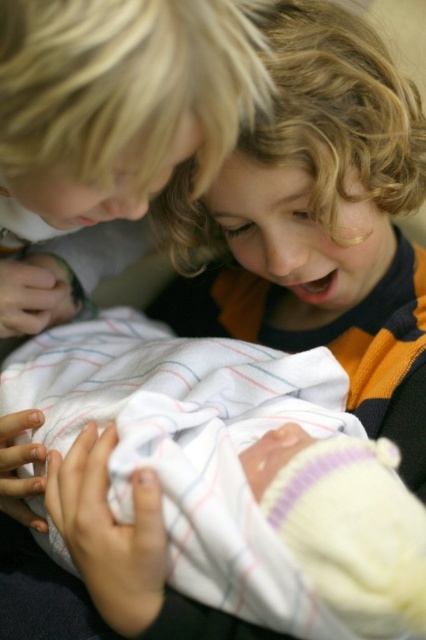
Question: Does white soft swaddling blanket at center have a greater width compared to blonde hair at upper left?

Choices:
 (A) no
 (B) yes

Answer: (B)

Question: Can you confirm if white soft swaddling blanket at center is positioned above blonde hair at upper left?

Choices:
 (A) no
 (B) yes

Answer: (A)

Question: Can you confirm if white soft swaddling blanket at center is wider than blonde hair at upper left?

Choices:
 (A) yes
 (B) no

Answer: (A)

Question: Which object is closer to the camera taking this photo?

Choices:
 (A) white soft swaddling blanket at center
 (B) blonde hair at upper left

Answer: (B)